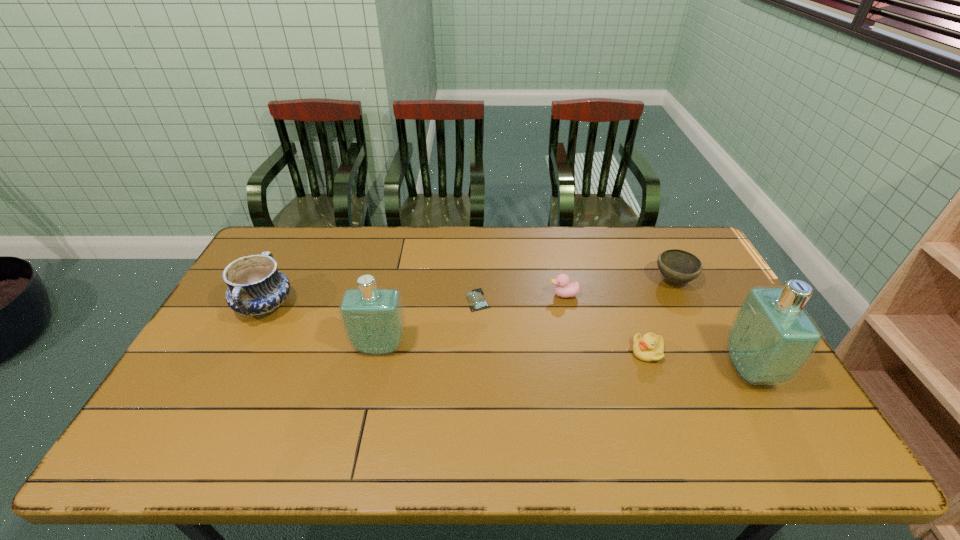
Please point a location where one more perfume can be added evenly. Please provide its 2D coordinates. Your answer should be formatted as a tuple, i.e. [(x, y)], where the tuple contains the x and y coordinates of a point satisfying the conditions above.

[(560, 357)]